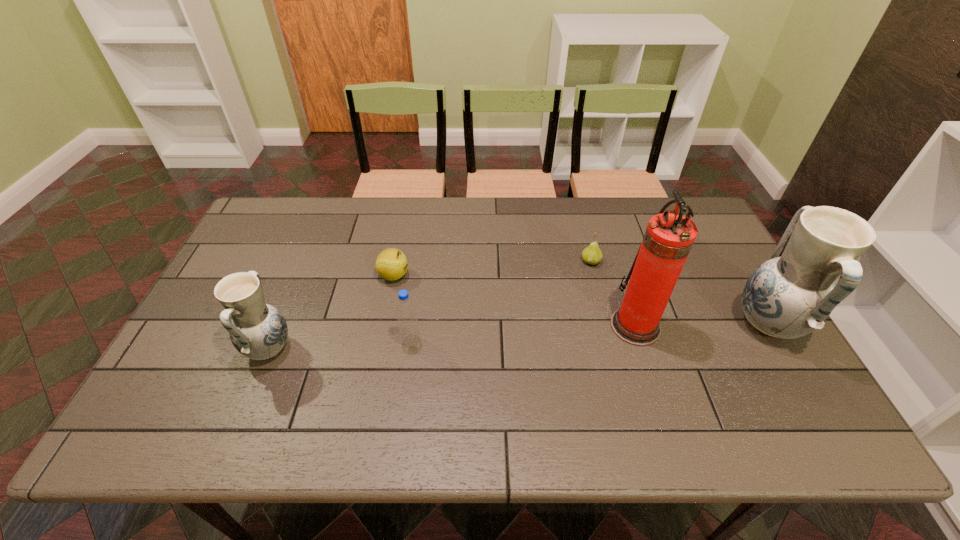
To ensure equal spacing by inserting another pottery among them, please point out a vacant spot for this new pottery. Please provide its 2D coordinates. Your answer should be formatted as a tuple, i.e. [(x, y)], where the tuple contains the x and y coordinates of a point satisfying the conditions above.

[(524, 337)]